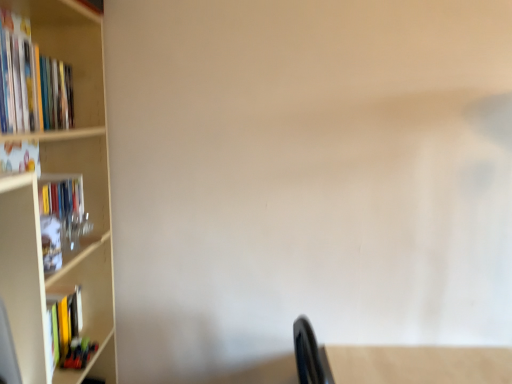
Question: Should I look upward or downward to see matte green book at lower left, arranged as the third book when viewed from the top?

Choices:
 (A) down
 (B) up

Answer: (A)

Question: Considering the relative sizes of hardcover book at left, which is the second book from top to bottom, and matte green book at lower left, the first book when ordered from bottom to top, in the image provided, is hardcover book at left, which is the second book from top to bottom, shorter than matte green book at lower left, the first book when ordered from bottom to top,?

Choices:
 (A) yes
 (B) no

Answer: (B)

Question: Is hardcover book at left, which is the second book from top to bottom, closer to camera compared to matte green book at lower left, the first book when ordered from bottom to top?

Choices:
 (A) no
 (B) yes

Answer: (B)

Question: From a real-world perspective, is hardcover book at left, which is the second book from bottom to top, positioned under matte green book at lower left, the first book when ordered from bottom to top, based on gravity?

Choices:
 (A) no
 (B) yes

Answer: (A)

Question: From the image's perspective, is hardcover book at left, which is the second book from top to bottom, under matte green book at lower left, the first book when ordered from bottom to top?

Choices:
 (A) no
 (B) yes

Answer: (A)

Question: Would you say hardcover book at left, which is the second book from top to bottom, is a long distance from matte green book at lower left, arranged as the third book when viewed from the top?

Choices:
 (A) no
 (B) yes

Answer: (A)

Question: Does hardcover book at left, which is the second book from top to bottom, turn towards matte green book at lower left, the first book when ordered from bottom to top?

Choices:
 (A) no
 (B) yes

Answer: (A)

Question: Does matte green book at lower left, arranged as the third book when viewed from the top, have a greater width compared to hardcover books at left, which ranks as the 1th book in top-to-bottom order?

Choices:
 (A) yes
 (B) no

Answer: (B)

Question: Does matte green book at lower left, the first book when ordered from bottom to top, come in front of hardcover books at left, which is counted as the third book, starting from the bottom?

Choices:
 (A) no
 (B) yes

Answer: (A)

Question: Is matte green book at lower left, the first book when ordered from bottom to top, smaller than hardcover books at left, which is counted as the third book, starting from the bottom?

Choices:
 (A) yes
 (B) no

Answer: (A)

Question: Could you tell me if matte green book at lower left, the first book when ordered from bottom to top, is facing hardcover books at left, which ranks as the 1th book in top-to-bottom order?

Choices:
 (A) no
 (B) yes

Answer: (A)

Question: Considering the relative sizes of matte green book at lower left, arranged as the third book when viewed from the top, and hardcover books at left, which is counted as the third book, starting from the bottom, in the image provided, is matte green book at lower left, arranged as the third book when viewed from the top, shorter than hardcover books at left, which is counted as the third book, starting from the bottom,?

Choices:
 (A) no
 (B) yes

Answer: (B)

Question: Is hardcover books at left, which is counted as the third book, starting from the bottom, at the back of matte green book at lower left, arranged as the third book when viewed from the top?

Choices:
 (A) no
 (B) yes

Answer: (A)

Question: Are matte green book at lower left, the first book when ordered from bottom to top, and hardcover book at left, which is the second book from bottom to top, located far from each other?

Choices:
 (A) no
 (B) yes

Answer: (A)